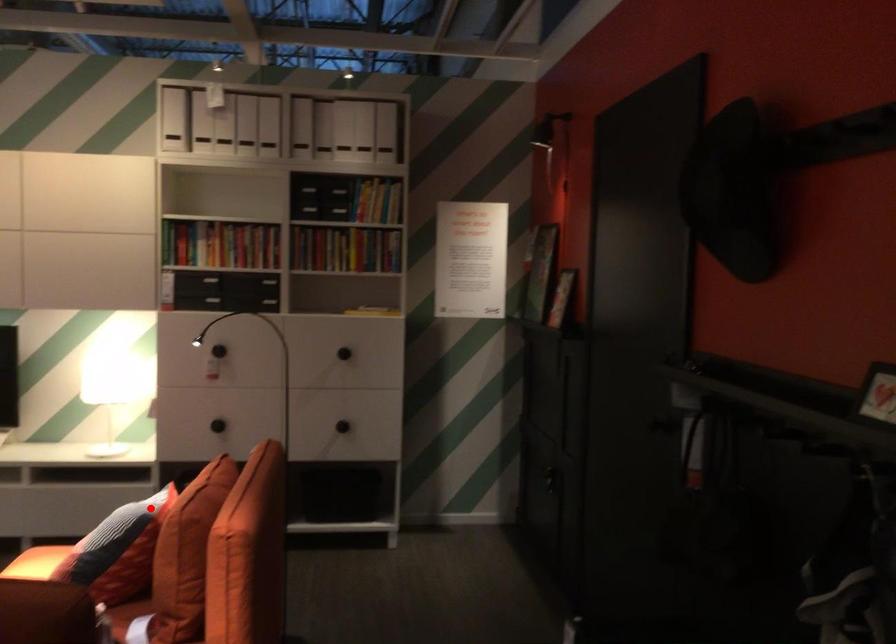
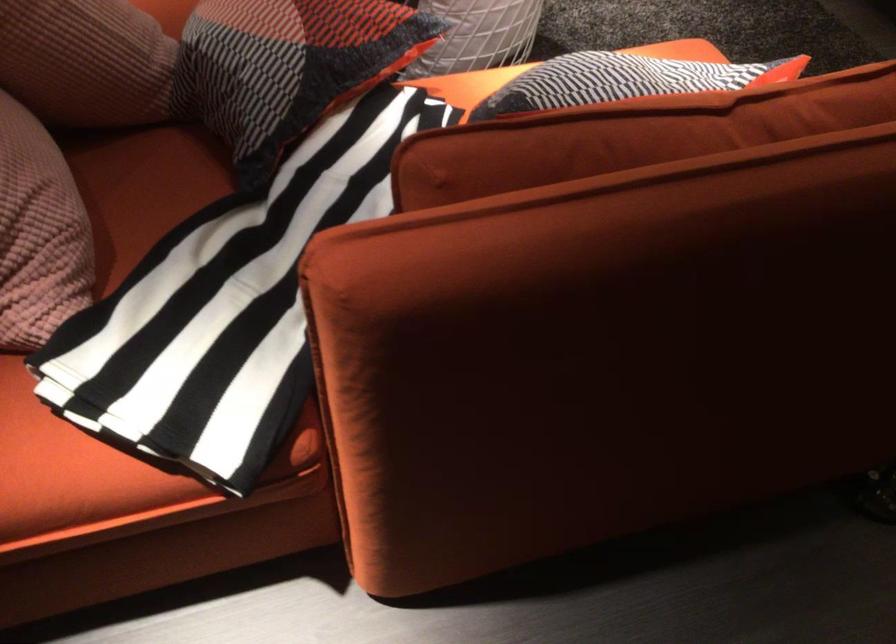
Where in the second image is the point corresponding to the highlighted location from the first image?

(623, 80)